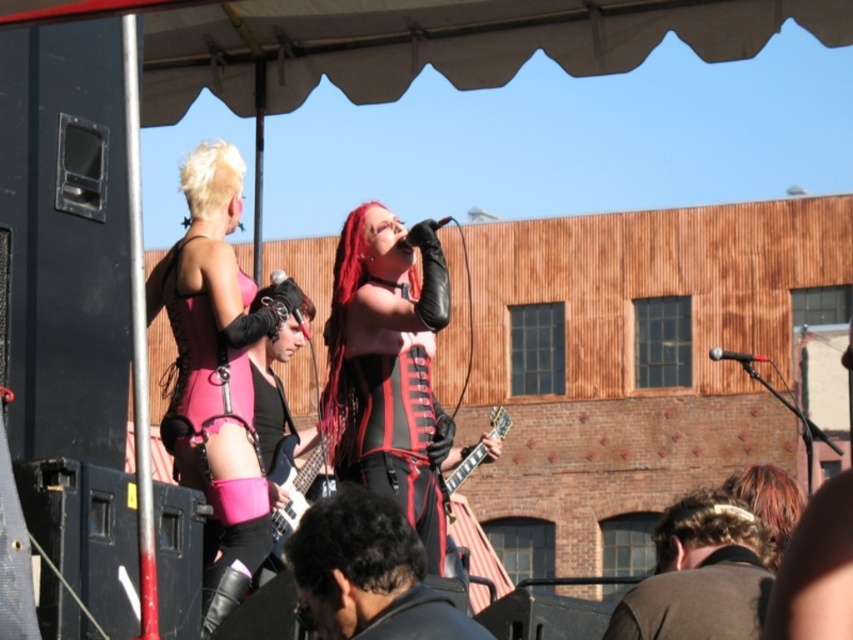
Which is above, black leather jacket at lower center or shiny black guitar at center?

black leather jacket at lower center is higher up.

Is point (390, 609) positioned behind point (288, 438)?

No, (390, 609) is closer to viewer.

Identify the location of black leather jacket at lower center. The width and height of the screenshot is (853, 640). pos(368,573).

Which is behind, point (352, 572) or point (740, 541)?

Positioned behind is point (740, 541).

Image resolution: width=853 pixels, height=640 pixels. Describe the element at coordinates (368, 573) in the screenshot. I see `black leather jacket at lower center` at that location.

Which is behind, point (393, 563) or point (709, 538)?

The point (709, 538) is behind.

Identify the location of black leather jacket at lower center. (368, 573).

Who is more distant from viewer, (190, 346) or (677, 584)?

Positioned behind is point (190, 346).

Who is more forward, (231,307) or (704,602)?

Point (704,602)

Where is `pink matte corset at upper left`? Image resolution: width=853 pixels, height=640 pixels. pink matte corset at upper left is located at coordinates (218, 374).